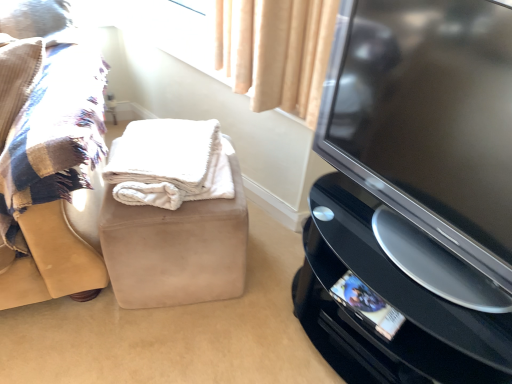
Question: Considering their positions, is black glossy tv at right located in front of or behind white fluffy blanket at center?

Choices:
 (A) behind
 (B) front

Answer: (B)

Question: From a real-world perspective, is black glossy tv at right above or below white fluffy blanket at center?

Choices:
 (A) above
 (B) below

Answer: (A)

Question: Based on their relative distances, which object is nearer to the black glossy tv at right?

Choices:
 (A) beige suede ottoman at center, which ranks as the 1th furniture in right-to-left order
 (B) plaid fabric cushion at left, which ranks as the second furniture in right-to-left order
 (C) black glossy tv at right
 (D) white fluffy blanket at center

Answer: (C)

Question: Based on their relative distances, which object is nearer to the plaid fabric cushion at left, arranged as the first furniture when viewed from the left?

Choices:
 (A) black glossy tv at right
 (B) white fluffy blanket at center
 (C) black glossy tv at right
 (D) beige suede ottoman at center, positioned as the second furniture in left-to-right order

Answer: (D)